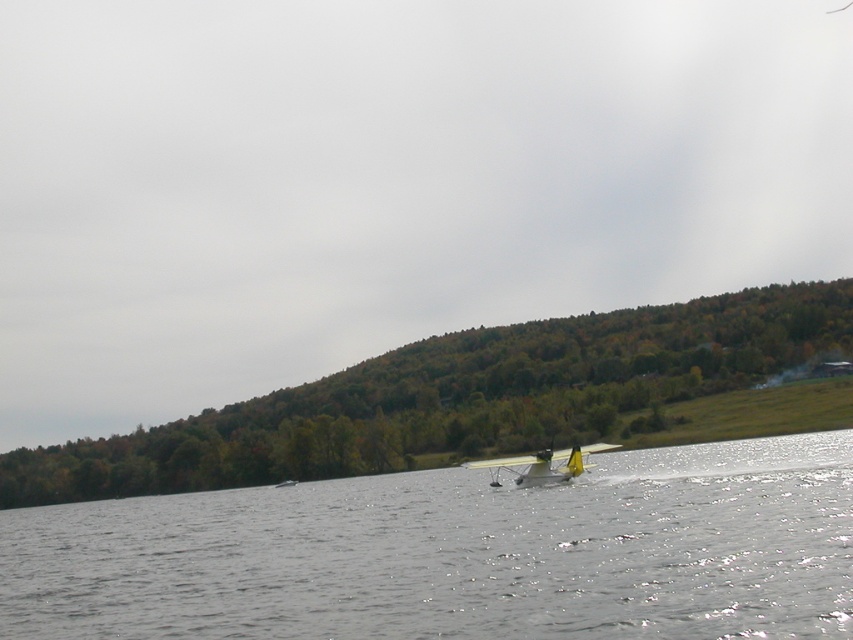
Which is below, green leafy hillside at center or yellow matte seaplane at center?

Positioned lower is green leafy hillside at center.

Is green leafy hillside at center to the right of yellow matte seaplane at center from the viewer's perspective?

No, green leafy hillside at center is not to the right of yellow matte seaplane at center.

Image resolution: width=853 pixels, height=640 pixels. In order to click on green leafy hillside at center in this screenshot , I will do `click(460, 397)`.

You are a GUI agent. You are given a task and a screenshot of the screen. Output one action in this format:
    pyautogui.click(x=<x>, y=<y>)
    Task: Click on the green leafy hillside at center
    
    Given the screenshot: What is the action you would take?
    pyautogui.click(x=460, y=397)

Is point (404, 484) less distant than point (592, 449)?

No.

Who is higher up, clear water at center or yellow matte seaplane at center?

yellow matte seaplane at center

Measure the distance between clear water at center and camera.

clear water at center and camera are 14.75 meters apart from each other.

Locate an element on the screen. The image size is (853, 640). clear water at center is located at coordinates (459, 554).

Which is more to the right, clear water at center or green leafy hillside at center?

From the viewer's perspective, clear water at center appears more on the right side.

Where is `clear water at center`? The width and height of the screenshot is (853, 640). clear water at center is located at coordinates (459, 554).

The width and height of the screenshot is (853, 640). I want to click on clear water at center, so click(459, 554).